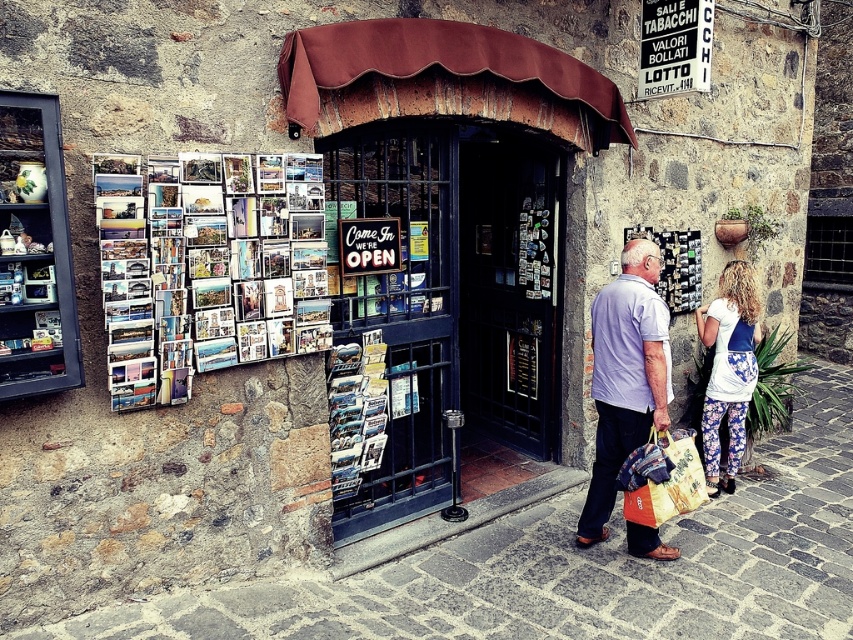
Question: Considering the real-world distances, which object is closest to the light purple cotton shirt at center?

Choices:
 (A) patterned fabric shopping bag at lower right
 (B) floral leggings at lower right
 (C) printed paper magazine at center

Answer: (A)

Question: Does printed paper collage at upper left have a greater width compared to floral leggings at lower right?

Choices:
 (A) no
 (B) yes

Answer: (B)

Question: Observing the image, what is the correct spatial positioning of floral leggings at lower right in reference to patterned fabric shopping bag at lower right?

Choices:
 (A) above
 (B) below

Answer: (A)

Question: Based on their relative distances, which object is nearer to the printed paper collage at upper left?

Choices:
 (A) light purple cotton shirt at center
 (B) printed paper magazine at center
 (C) patterned fabric shopping bag at lower right

Answer: (B)

Question: Is floral leggings at lower right to the right of printed paper magazine at center from the viewer's perspective?

Choices:
 (A) yes
 (B) no

Answer: (A)

Question: Among these objects, which one is farthest from the camera?

Choices:
 (A) floral leggings at lower right
 (B) printed paper collage at upper left

Answer: (A)